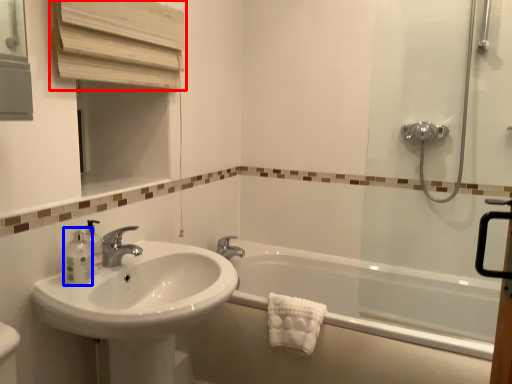
Question: Which point is further to the camera, medicine cabinet (highlighted by a red box) or toiletry (highlighted by a blue box)?

Choices:
 (A) medicine cabinet
 (B) toiletry

Answer: (B)